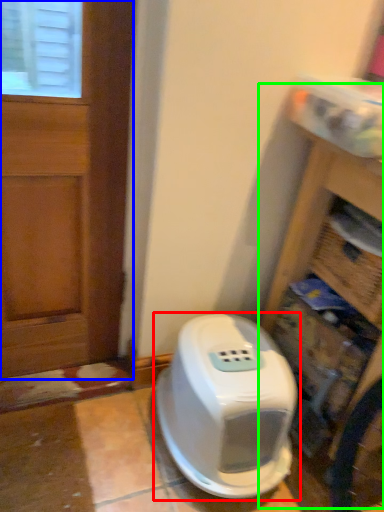
Question: Estimate the real-world distances between objects in this image. Which object is closer to home appliance (highlighted by a red box), door (highlighted by a blue box) or bookshelf (highlighted by a green box)?

Choices:
 (A) door
 (B) bookshelf

Answer: (B)